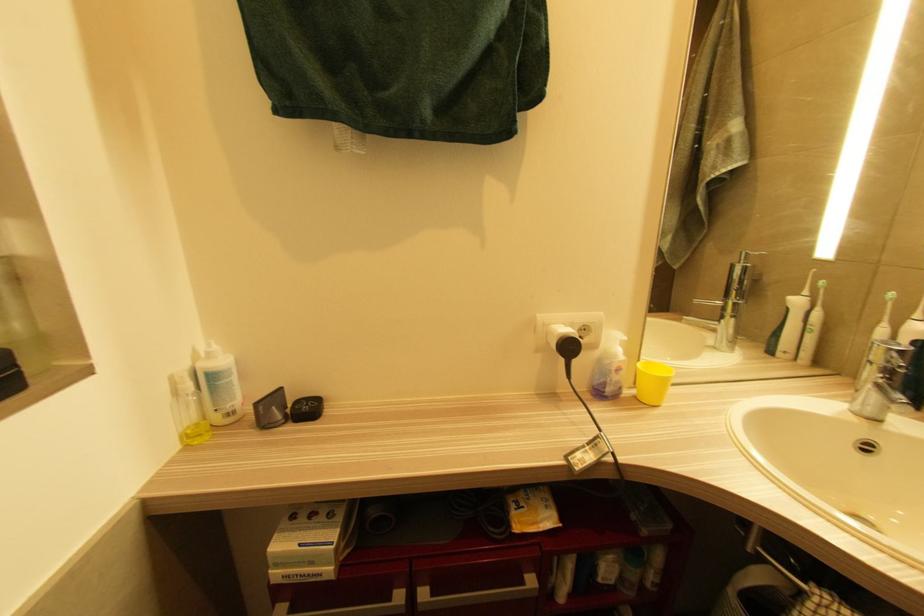
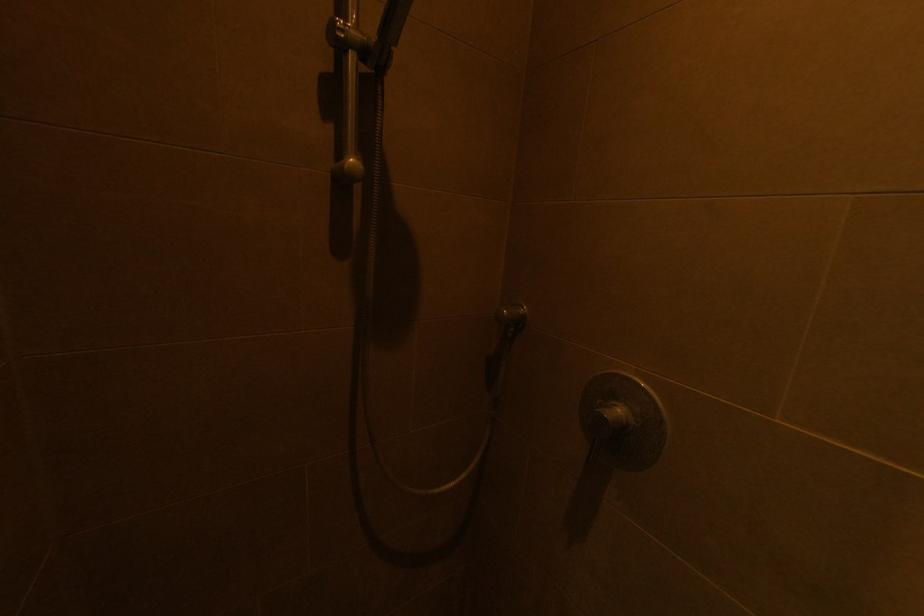
Question: Which direction would the cameraman need to move to produce the second image? Reply with the corresponding letter.

Choices:
 (A) Left
 (B) Right
 (C) Forward
 (D) Backward

Answer: (B)